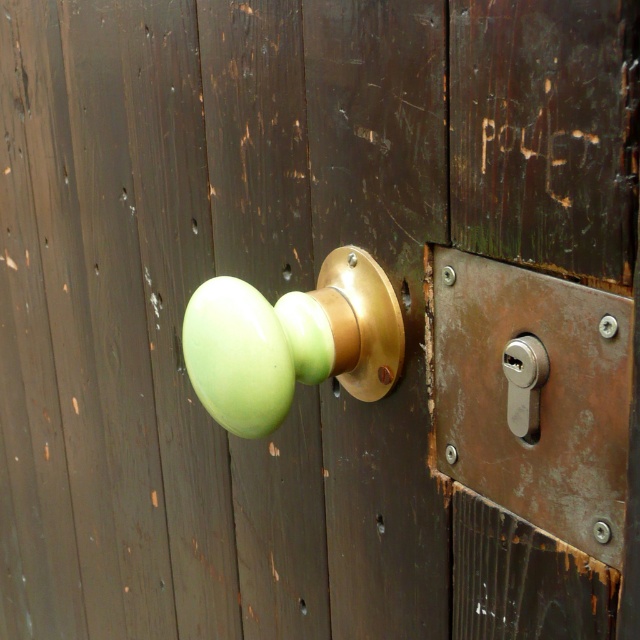
You are standing in front of the door with the aged wooden surface. There is a green matte door handle at center marked by point (x=291, y=340). If you reach out to touch the handle, which part of the door will feel rougher to your hand, the area around the green matte door handle at center or the rest of the wooden door?

The rest of the wooden door will feel rougher because the green matte door handle at center has a smooth, glossy surface contrasting with the matte finish of the.

You are trying to open the door but the green matte door handle at center is stuck. You notice the satin silver lock at right is slightly loose. Which object should you try adjusting first to potentially unlock the door?

You should adjust the satin silver lock at right first since it is mentioned to be slightly loose, which might indicate it can be manipulated to unlock the door. The green matte door handle at center being stuck suggests it might not be the right component to focus on for unlocking.